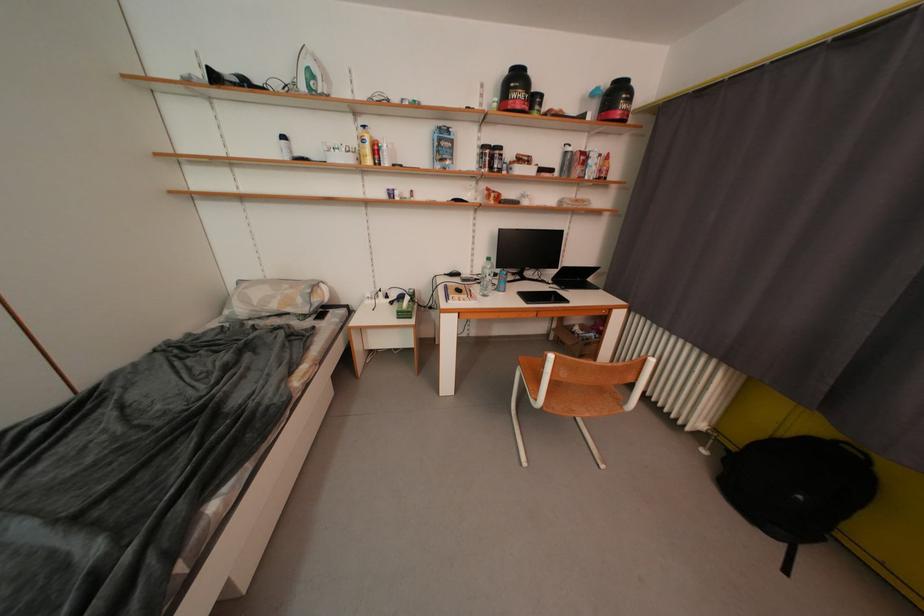
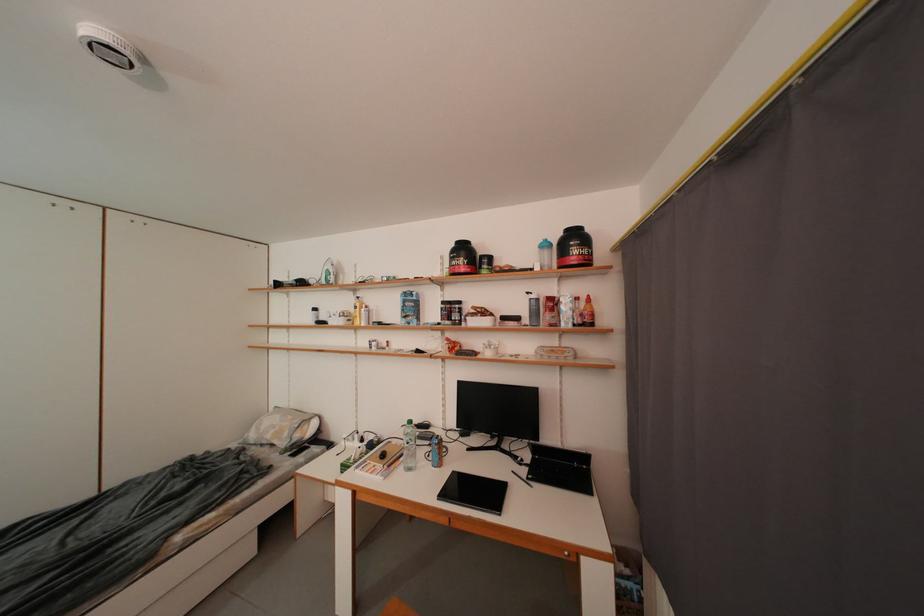
Where in the second image is the point corresponding to (x=307, y=304) from the first image?

(294, 438)